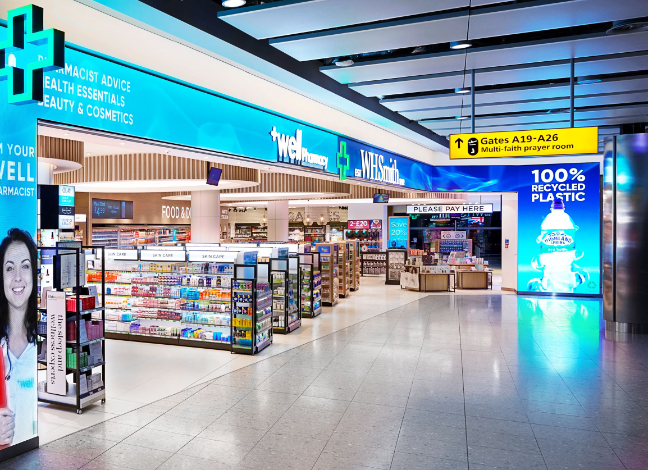
Identify the location of floor. coord(442,376).